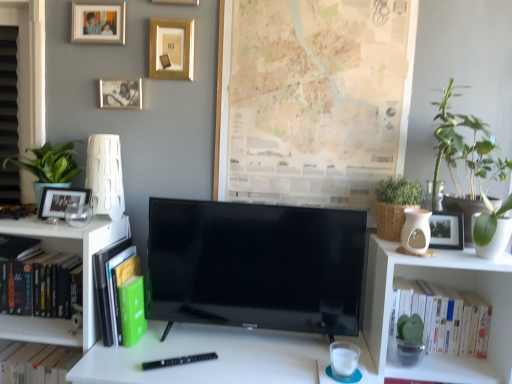
Question: Which direction should I rotate to face brushed metal picture frame at upper center, the 5th picture frame in the bottom-to-top sequence, — up or down?

Choices:
 (A) up
 (B) down

Answer: (A)

Question: Does green matte flowerpot at right have a lesser height compared to black glossy tv at center?

Choices:
 (A) no
 (B) yes

Answer: (B)

Question: Does green matte flowerpot at right have a greater width compared to black glossy tv at center?

Choices:
 (A) no
 (B) yes

Answer: (B)

Question: Is the depth of green matte flowerpot at right greater than that of black glossy tv at center?

Choices:
 (A) yes
 (B) no

Answer: (B)

Question: From the image's perspective, is green matte flowerpot at right on top of black glossy tv at center?

Choices:
 (A) no
 (B) yes

Answer: (B)

Question: Is black glossy tv at center surrounded by green matte flowerpot at right?

Choices:
 (A) no
 (B) yes

Answer: (A)

Question: Considering the relative positions of green matte flowerpot at right and black glossy tv at center in the image provided, is green matte flowerpot at right in front of black glossy tv at center?

Choices:
 (A) no
 (B) yes

Answer: (B)

Question: Is white matte book at right, which is the first book from right to left, to the left of gold metallic picture frame at upper center, acting as the third picture frame starting from the bottom, from the viewer's perspective?

Choices:
 (A) no
 (B) yes

Answer: (A)

Question: Are white matte book at right, which is the first book from right to left, and gold metallic picture frame at upper center, placed as the 3th picture frame when sorted from top to bottom, far apart?

Choices:
 (A) yes
 (B) no

Answer: (A)

Question: Considering the relative sizes of white matte book at right, the third book positioned from the left, and gold metallic picture frame at upper center, acting as the third picture frame starting from the bottom, in the image provided, is white matte book at right, the third book positioned from the left, thinner than gold metallic picture frame at upper center, acting as the third picture frame starting from the bottom,?

Choices:
 (A) no
 (B) yes

Answer: (A)

Question: Does white matte book at right, the third book positioned from the left, have a larger size compared to gold metallic picture frame at upper center, placed as the 3th picture frame when sorted from top to bottom?

Choices:
 (A) yes
 (B) no

Answer: (A)

Question: Is gold metallic picture frame at upper center, acting as the third picture frame starting from the bottom, at the back of white matte book at right, which is the first book from right to left?

Choices:
 (A) yes
 (B) no

Answer: (B)

Question: Considering the relative sizes of white matte book at right, the third book positioned from the left, and gold metallic picture frame at upper center, acting as the third picture frame starting from the bottom, in the image provided, is white matte book at right, the third book positioned from the left, wider than gold metallic picture frame at upper center, acting as the third picture frame starting from the bottom,?

Choices:
 (A) yes
 (B) no

Answer: (A)

Question: Does green matte flowerpot at right have a lesser height compared to beige paper map at upper center?

Choices:
 (A) no
 (B) yes

Answer: (B)